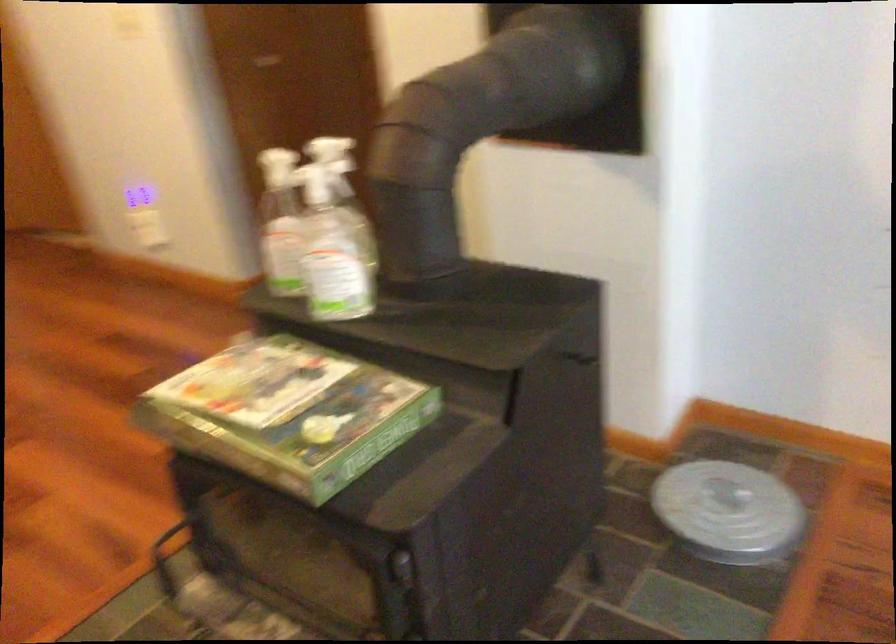
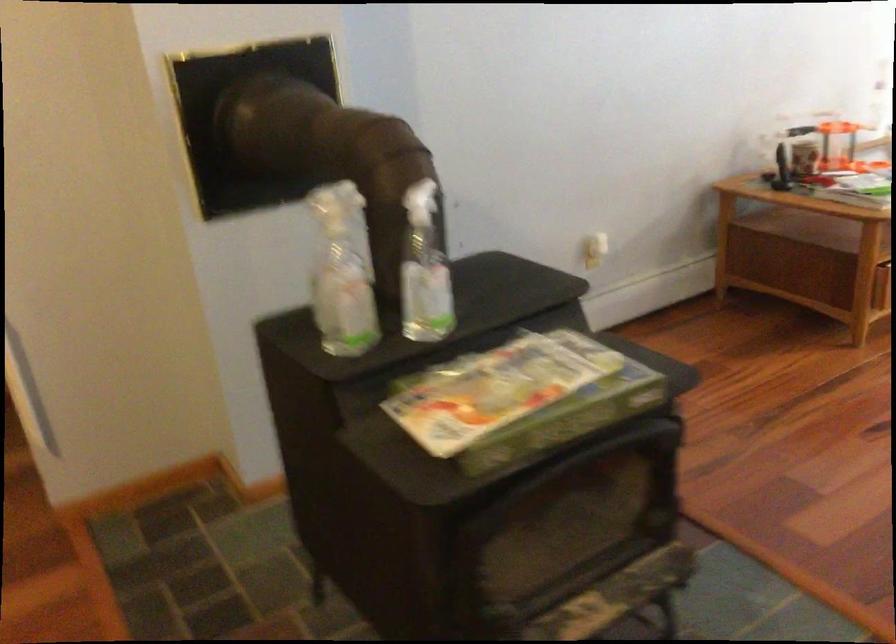
Where in the second image is the point corresponding to point 401,567 from the first image?

(692, 421)